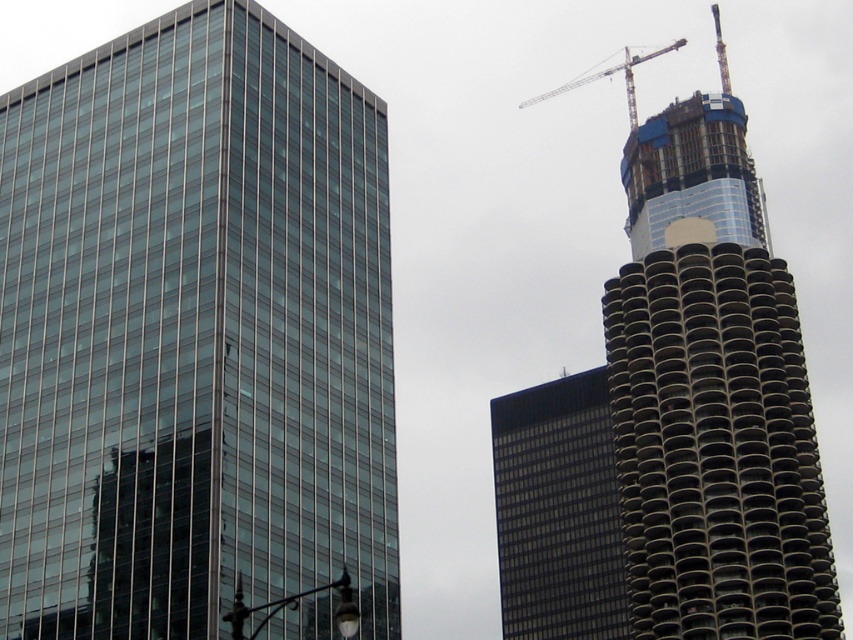
Which is more to the right, glassy reflective skyscraper at left or metallic gray crane at upper right?

Positioned to the right is metallic gray crane at upper right.

Is the position of glassy reflective skyscraper at left less distant than that of metallic gray crane at upper right?

That is True.

Does point (67, 483) come in front of point (630, 61)?

Yes, it is.

Identify the location of glassy reflective skyscraper at left. This screenshot has height=640, width=853. (193, 333).

Who is more forward, (538, 595) or (630, 128)?

Point (538, 595)

Which of these two, matte glass skyscraper at center or metallic gray crane at upper right, stands shorter?

matte glass skyscraper at center is shorter.

This screenshot has width=853, height=640. What are the coordinates of `matte glass skyscraper at center` in the screenshot? It's located at (558, 512).

At what (x,y) coordinates should I click in order to perform the action: click on matte glass skyscraper at center. Please return your answer as a coordinate pair (x, y). Looking at the image, I should click on (558, 512).

Between glassy reflective skyscraper at left and glassy concrete tower at upper right, which one appears on the right side from the viewer's perspective?

From the viewer's perspective, glassy concrete tower at upper right appears more on the right side.

Measure the distance from glassy reflective skyscraper at left to glassy concrete tower at upper right.

glassy reflective skyscraper at left is 41.60 meters away from glassy concrete tower at upper right.

Is point (167, 49) positioned before point (712, 131)?

Yes, it is in front of point (712, 131).

I want to click on glassy reflective skyscraper at left, so click(193, 333).